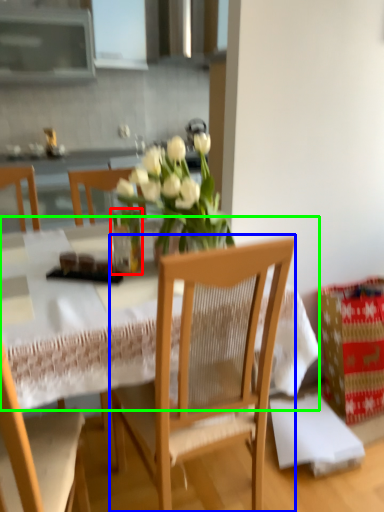
Question: Considering the real-world distances, which object is farthest from glass vase (highlighted by a red box)? chair (highlighted by a blue box) or round table (highlighted by a green box)?

Choices:
 (A) chair
 (B) round table

Answer: (A)